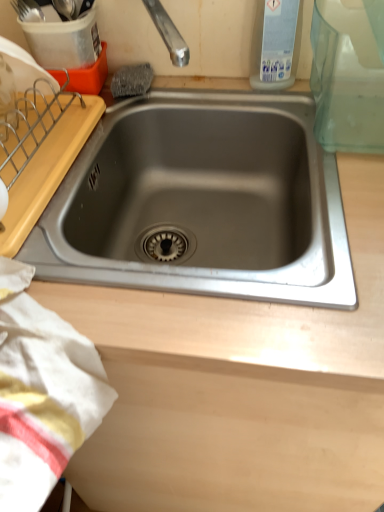
Question: Considering the relative positions of transparent plastic bottle at upper right and white cotton towel at lower left in the image provided, is transparent plastic bottle at upper right to the left of white cotton towel at lower left from the viewer's perspective?

Choices:
 (A) yes
 (B) no

Answer: (B)

Question: Would you say white cotton towel at lower left is part of transparent plastic bottle at upper right's contents?

Choices:
 (A) no
 (B) yes

Answer: (A)

Question: Considering the relative sizes of transparent plastic bottle at upper right and white cotton towel at lower left in the image provided, is transparent plastic bottle at upper right shorter than white cotton towel at lower left?

Choices:
 (A) no
 (B) yes

Answer: (A)

Question: Would you say transparent plastic bottle at upper right is outside white cotton towel at lower left?

Choices:
 (A) yes
 (B) no

Answer: (A)

Question: Considering the relative sizes of transparent plastic bottle at upper right and white cotton towel at lower left in the image provided, is transparent plastic bottle at upper right taller than white cotton towel at lower left?

Choices:
 (A) no
 (B) yes

Answer: (B)

Question: Looking at their shapes, would you say stainless steel sink at center is wider or thinner than white cotton towel at lower left?

Choices:
 (A) thin
 (B) wide

Answer: (B)

Question: From a real-world perspective, is stainless steel sink at center above or below white cotton towel at lower left?

Choices:
 (A) above
 (B) below

Answer: (B)

Question: Is stainless steel sink at center inside the boundaries of white cotton towel at lower left, or outside?

Choices:
 (A) inside
 (B) outside

Answer: (B)

Question: Does point (39, 237) appear closer or farther from the camera than point (6, 350)?

Choices:
 (A) farther
 (B) closer

Answer: (A)

Question: From their relative heights in the image, would you say transparent plastic bottle at upper right is taller or shorter than white cotton towel at lower left?

Choices:
 (A) tall
 (B) short

Answer: (A)

Question: In the image, is transparent plastic bottle at upper right positioned in front of or behind white cotton towel at lower left?

Choices:
 (A) front
 (B) behind

Answer: (B)

Question: Is transparent plastic bottle at upper right bigger or smaller than white cotton towel at lower left?

Choices:
 (A) small
 (B) big

Answer: (A)

Question: Is point (268, 86) closer or farther from the camera than point (76, 367)?

Choices:
 (A) closer
 (B) farther

Answer: (B)

Question: Based on their positions, is stainless steel sink at center located to the left or right of transparent plastic bottle at upper right?

Choices:
 (A) right
 (B) left

Answer: (B)

Question: From a real-world perspective, is stainless steel sink at center physically located above or below transparent plastic bottle at upper right?

Choices:
 (A) below
 (B) above

Answer: (A)